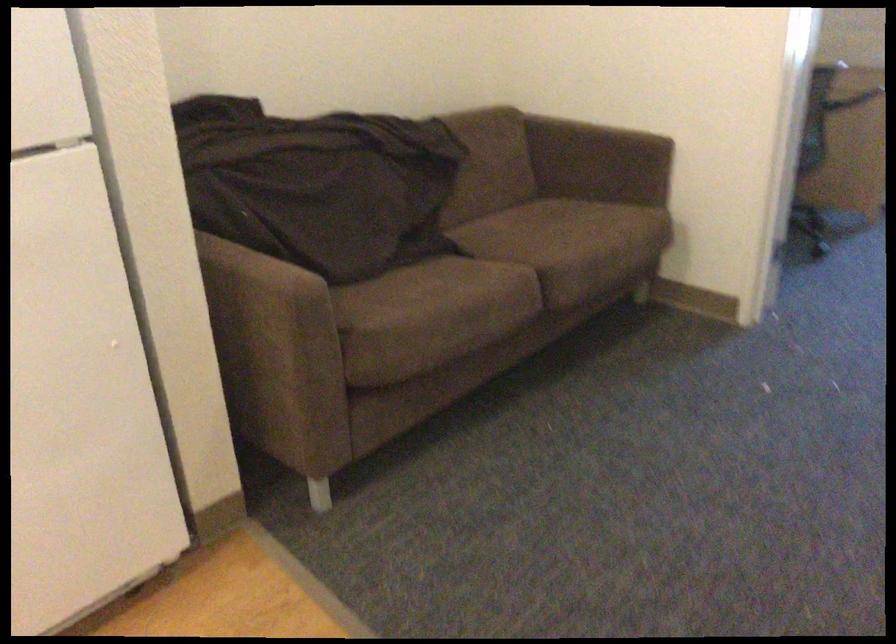
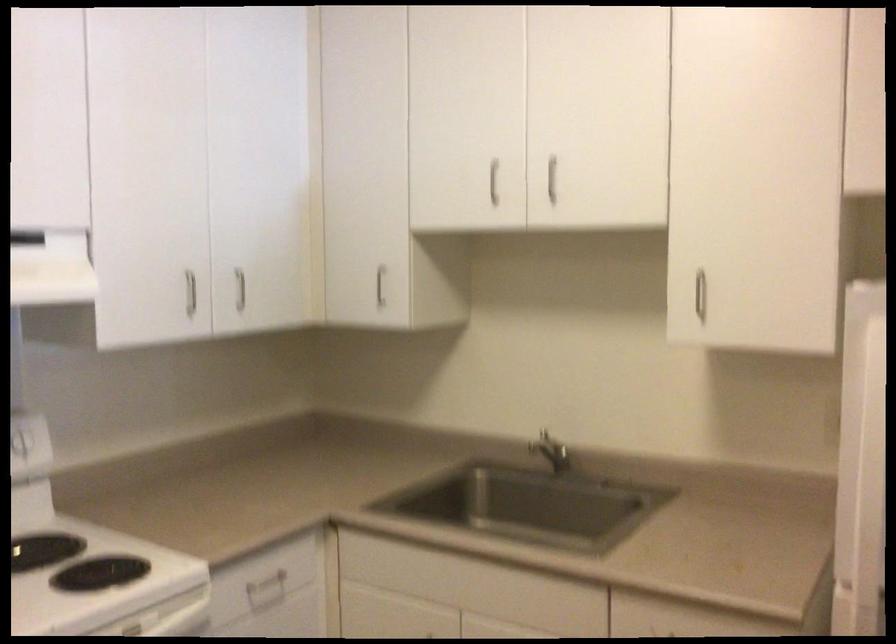
Question: Based on the continuous images, in which direction is the camera rotating? Reply with the corresponding letter.

Choices:
 (A) Left
 (B) Right
 (C) Up
 (D) Down

Answer: (A)